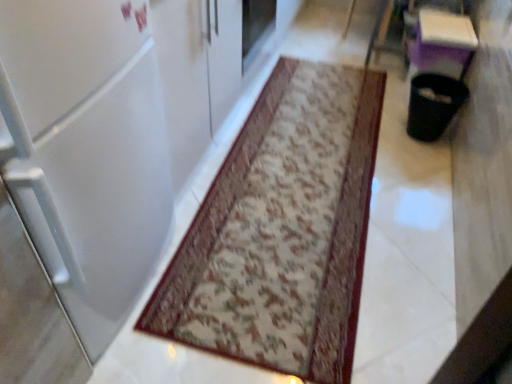
Describe the element at coordinates (86, 151) in the screenshot. The height and width of the screenshot is (384, 512). I see `white glossy refrigerator at center` at that location.

What are the coordinates of `white glossy refrigerator at center` in the screenshot? It's located at (86, 151).

The height and width of the screenshot is (384, 512). What do you see at coordinates (277, 245) in the screenshot? I see `floral carpet at center` at bounding box center [277, 245].

Measure the distance between floral carpet at center and camera.

4.17 feet.

Measure the distance between point (364, 182) and camera.

6.28 feet.

What is the approximate width of floral carpet at center?

1.36 meters.

Identify the location of floral carpet at center. This screenshot has height=384, width=512. (277, 245).

Locate an element on the screen. The image size is (512, 384). white glossy refrigerator at center is located at coordinates (86, 151).

Is floral carpet at center to the right of white glossy refrigerator at center from the viewer's perspective?

Correct, you'll find floral carpet at center to the right of white glossy refrigerator at center.

Is floral carpet at center further to camera compared to white glossy refrigerator at center?

That is True.

Does point (243, 331) come farther from viewer compared to point (90, 175)?

Yes, point (243, 331) is behind point (90, 175).

From the image's perspective, is floral carpet at center under white glossy refrigerator at center?

Indeed, from the image's perspective, floral carpet at center is shown beneath white glossy refrigerator at center.

From a real-world perspective, does floral carpet at center sit lower than white glossy refrigerator at center?

Yes, from a real-world perspective, floral carpet at center is under white glossy refrigerator at center.

Is floral carpet at center wider than white glossy refrigerator at center?

Yes.

Does floral carpet at center have a greater height compared to white glossy refrigerator at center?

In fact, floral carpet at center may be shorter than white glossy refrigerator at center.

Who is bigger, floral carpet at center or white glossy refrigerator at center?

white glossy refrigerator at center.

Consider the image. Is floral carpet at center not within white glossy refrigerator at center?

That's correct, floral carpet at center is outside of white glossy refrigerator at center.

Is floral carpet at center next to white glossy refrigerator at center and touching it?

No, floral carpet at center is not with white glossy refrigerator at center.

Is floral carpet at center positioned with its back to white glossy refrigerator at center?

No.

Where is `door above the floral carpet at center (from a real-world perspective)`? This screenshot has height=384, width=512. door above the floral carpet at center (from a real-world perspective) is located at coordinates (86, 151).

Based on their positions, is white glossy refrigerator at center located to the left or right of floral carpet at center?

In the image, white glossy refrigerator at center appears on the left side of floral carpet at center.

Is white glossy refrigerator at center further to the viewer compared to floral carpet at center?

No.

Does point (99, 235) come closer to viewer compared to point (301, 342)?

Yes, point (99, 235) is in front of point (301, 342).

From the image's perspective, which is above, white glossy refrigerator at center or floral carpet at center?

white glossy refrigerator at center appears higher in the image.

From a real-world perspective, does white glossy refrigerator at center stand above floral carpet at center?

Yes, from a real-world perspective, white glossy refrigerator at center is over floral carpet at center

Which object is wider, white glossy refrigerator at center or floral carpet at center?

Wider between the two is floral carpet at center.

Who is shorter, white glossy refrigerator at center or floral carpet at center?

With less height is floral carpet at center.

Considering the sizes of objects white glossy refrigerator at center and floral carpet at center in the image provided, who is smaller, white glossy refrigerator at center or floral carpet at center?

With smaller size is floral carpet at center.

Is floral carpet at center completely or partially inside white glossy refrigerator at center?

Definitely not — floral carpet at center is not inside white glossy refrigerator at center.

Is white glossy refrigerator at center with floral carpet at center?

No, white glossy refrigerator at center is not beside floral carpet at center.

Could you tell me if white glossy refrigerator at center is facing floral carpet at center?

Yes, white glossy refrigerator at center is facing floral carpet at center.

What's the angular difference between white glossy refrigerator at center and floral carpet at center's facing directions?

white glossy refrigerator at center and floral carpet at center are facing 88 degrees away from each other.

Identify the location of mat below the white glossy refrigerator at center (from a real-world perspective). (277, 245).

Where is `mat located below the white glossy refrigerator at center (from the image's perspective)`? Image resolution: width=512 pixels, height=384 pixels. mat located below the white glossy refrigerator at center (from the image's perspective) is located at coordinates (277, 245).

Find the location of `mat below the white glossy refrigerator at center (from a real-world perspective)`. mat below the white glossy refrigerator at center (from a real-world perspective) is located at coordinates (277, 245).